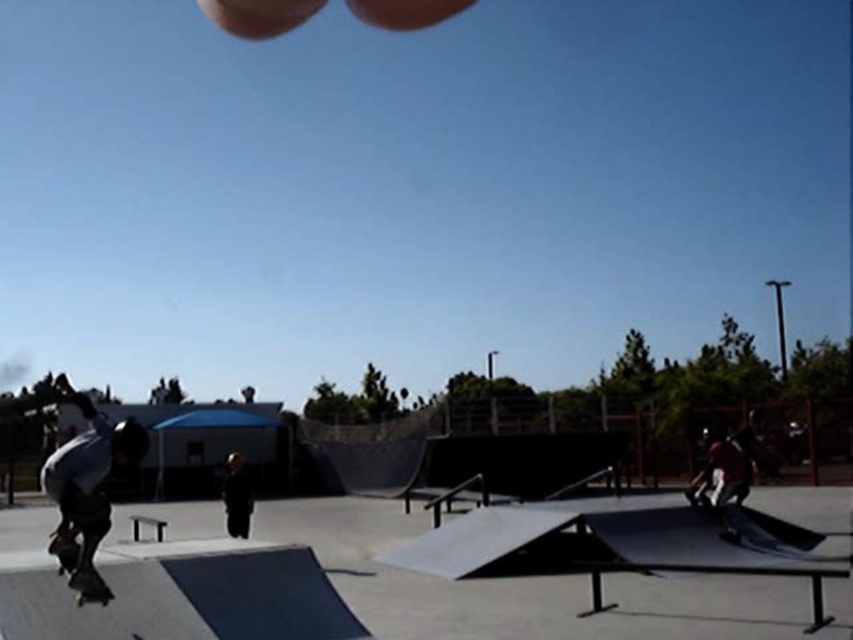
Question: Does smooth concrete ramp at center appear over dark gray matte skateboarder at lower left?

Choices:
 (A) no
 (B) yes

Answer: (B)

Question: Can you confirm if dark gray matte skateboarder at lower left is bigger than black matte skateboard at lower left?

Choices:
 (A) yes
 (B) no

Answer: (A)

Question: Which object is the closest to the smooth concrete ramp at center?

Choices:
 (A) dark gray matte skateboarder at lower left
 (B) black matte skateboard at lower left

Answer: (B)

Question: Is smooth concrete ramp at center smaller than dark gray matte skateboarder at lower left?

Choices:
 (A) no
 (B) yes

Answer: (B)

Question: Which point is closer to the camera?

Choices:
 (A) smooth concrete ramp at center
 (B) dark gray matte skateboarder at lower left
 (C) black matte skateboard at lower left

Answer: (B)

Question: Which of the following is the farthest from the observer?

Choices:
 (A) dark gray matte skateboarder at lower left
 (B) black matte skateboard at lower left

Answer: (B)